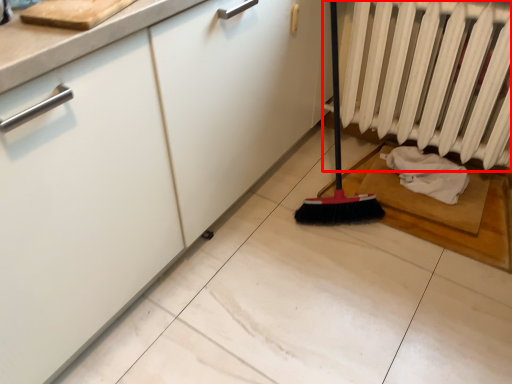
Question: From the image's perspective, what is the correct spatial positioning of radiator (annotated by the red box) in reference to material?

Choices:
 (A) below
 (B) above

Answer: (B)